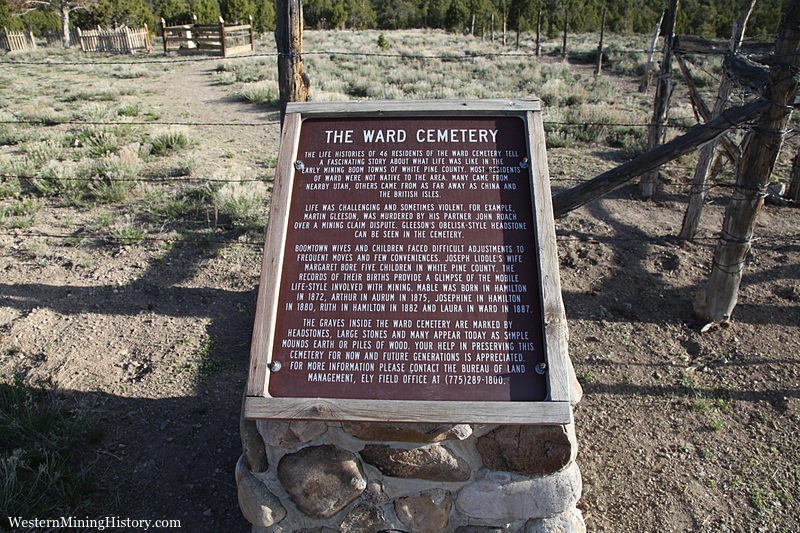
At what (x,y) coordinates should I click in order to perform the action: click on wiring. Please return your answer as a coordinate pair (x, y). Image resolution: width=800 pixels, height=533 pixels. Looking at the image, I should click on (402, 53).